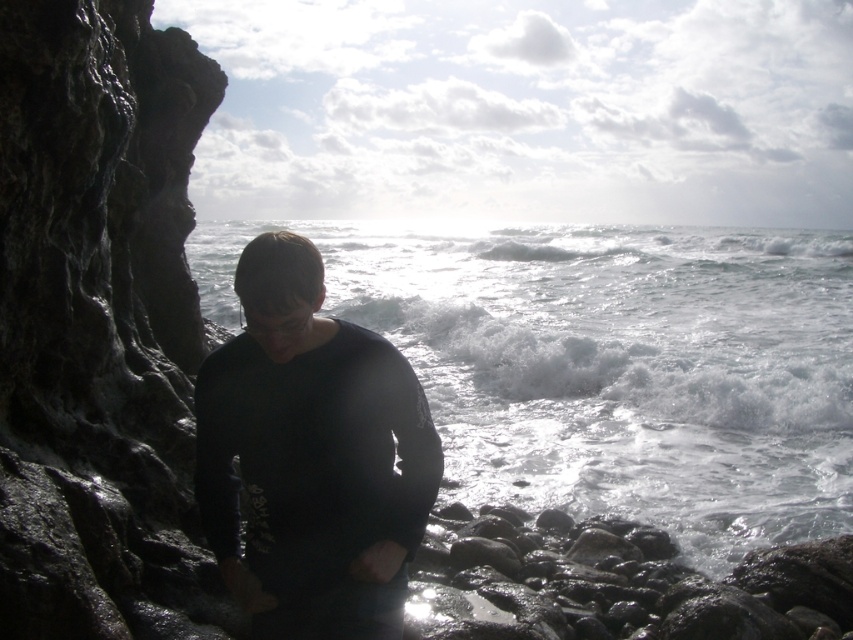
Does white frothy water at center have a lesser width compared to dark gray rocky cliff at left?

No.

Between white frothy water at center and dark gray rocky cliff at left, which one appears on the left side from the viewer's perspective?

From the viewer's perspective, dark gray rocky cliff at left appears more on the left side.

Where is `white frothy water at center`? The image size is (853, 640). white frothy water at center is located at coordinates 608,364.

Is point (90, 56) closer to camera compared to point (259, 369)?

No.

At what (x,y) coordinates should I click in order to perform the action: click on dark gray rocky cliff at left. Please return your answer as a coordinate pair (x, y). The height and width of the screenshot is (640, 853). Looking at the image, I should click on (100, 326).

Can you confirm if white frothy water at center is thinner than black matte shirt at center?

No.

I want to click on white frothy water at center, so click(608, 364).

Find the location of `white frothy water at center`. white frothy water at center is located at coordinates (608, 364).